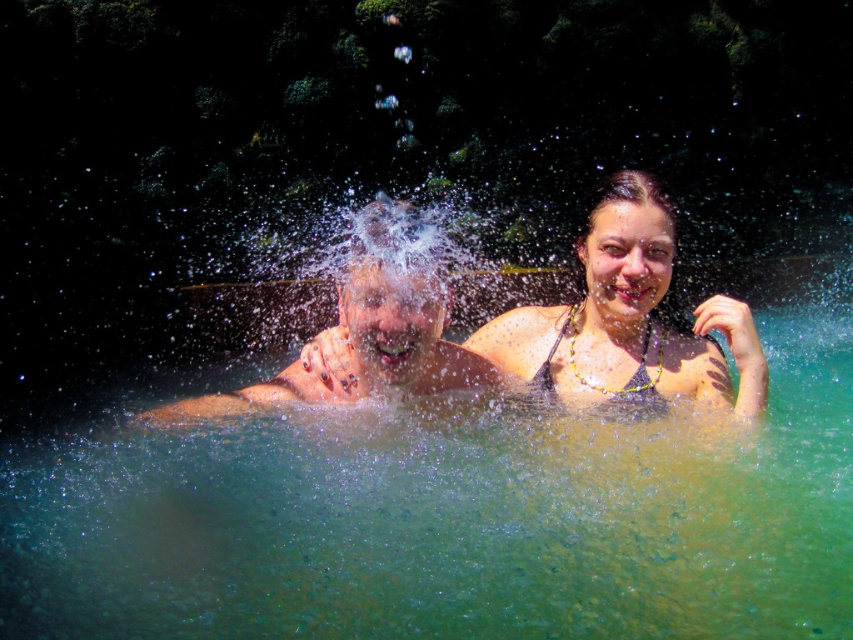
Is multicolored beaded necklace at upper right positioned at the back of smooth skin child at center?

That is True.

Is multicolored beaded necklace at upper right wider than smooth skin child at center?

No.

Measure the distance between point (634, 376) and camera.

Point (634, 376) and camera are 2.35 meters apart from each other.

The height and width of the screenshot is (640, 853). Identify the location of multicolored beaded necklace at upper right. (631, 321).

Who is shorter, multicolored beaded necklace at upper right or black textured bikini top at center?

Standing shorter between the two is black textured bikini top at center.

Between point (662, 387) and point (614, 397), which one is positioned behind?

Point (662, 387)

Does point (622, 392) come farther from viewer compared to point (540, 390)?

No, it is not.

At what (x,y) coordinates should I click in order to perform the action: click on multicolored beaded necklace at upper right. Please return your answer as a coordinate pair (x, y). The height and width of the screenshot is (640, 853). Looking at the image, I should click on (631, 321).

Can you confirm if smooth skin child at center is positioned to the right of black textured bikini top at center?

Incorrect, smooth skin child at center is not on the right side of black textured bikini top at center.

Measure the distance between point [300,388] and camera.

A distance of 2.20 meters exists between point [300,388] and camera.

At what (x,y) coordinates should I click in order to perform the action: click on smooth skin child at center. Please return your answer as a coordinate pair (x, y). Looking at the image, I should click on (370, 333).